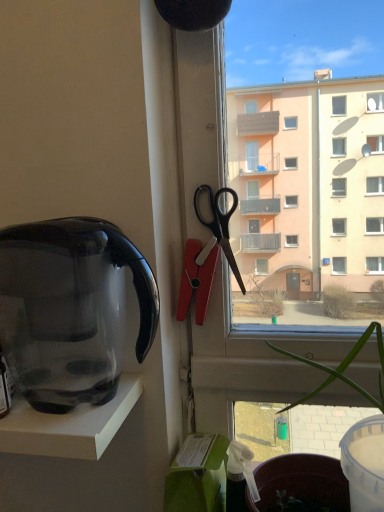
What do you see at coordinates (220, 225) in the screenshot?
I see `black plastic scissors at upper right` at bounding box center [220, 225].

You are a GUI agent. You are given a task and a screenshot of the screen. Output one action in this format:
    pyautogui.click(x=<x>, y=<y>)
    Task: Click on the black plastic scissors at upper right
    The image size is (384, 512).
    Given the screenshot: What is the action you would take?
    pyautogui.click(x=220, y=225)

In order to face green leafy plant at center, should I rotate leftwards or rightwards?

Turn right approximately 19.786 degrees to face it.

Locate an element on the screen. The image size is (384, 512). transparent plastic kettle at left is located at coordinates (71, 309).

Is transparent plastic kettle at left located outside green leafy plant at center?

Yes.

Which is closer to the camera, (81, 243) or (380, 393)?

Point (81, 243) is positioned closer to the camera compared to point (380, 393).

Is transparent plastic kettle at left bigger or smaller than green leafy plant at center?

In the image, transparent plastic kettle at left appears to be smaller than green leafy plant at center.

Would you say green leafy plant at center is to the left or to the right of black plastic scissors at upper right in the picture?

Based on their positions, green leafy plant at center is located to the right of black plastic scissors at upper right.

Between green leafy plant at center and black plastic scissors at upper right, which one has smaller size?

Smaller between the two is black plastic scissors at upper right.

Which object is closer to the camera, black plastic scissors at upper right or green leafy plant at center?

green leafy plant at center is more forward.

From the picture: From a real-world perspective, relative to green leafy plant at center, is black plastic scissors at upper right vertically above or below?

black plastic scissors at upper right is above green leafy plant at center.

Is black plastic scissors at upper right spatially inside green leafy plant at center, or outside of it?

black plastic scissors at upper right lies outside green leafy plant at center.

Is transparent plastic kettle at left with black plastic scissors at upper right?

No, transparent plastic kettle at left is not touching black plastic scissors at upper right.

How many degrees apart are the facing directions of transparent plastic kettle at left and black plastic scissors at upper right?

transparent plastic kettle at left and black plastic scissors at upper right are facing 99.7 degrees away from each other.

In terms of width, does transparent plastic kettle at left look wider or thinner when compared to black plastic scissors at upper right?

Considering their sizes, transparent plastic kettle at left looks broader than black plastic scissors at upper right.

Considering the points (24, 291) and (210, 224), which point is in front, point (24, 291) or point (210, 224)?

Positioned in front is point (24, 291).

Which of these two, black plastic scissors at upper right or transparent plastic kettle at left, stands shorter?

With less height is black plastic scissors at upper right.

Where is `scissors above the transparent plastic kettle at left (from a real-world perspective)`? The height and width of the screenshot is (512, 384). scissors above the transparent plastic kettle at left (from a real-world perspective) is located at coordinates (220, 225).

Considering the points (216, 239) and (116, 239), which point is in front, point (216, 239) or point (116, 239)?

Point (116, 239)

In terms of width, does black plastic scissors at upper right look wider or thinner when compared to transparent plastic kettle at left?

black plastic scissors at upper right is thinner than transparent plastic kettle at left.

From the image's perspective, does green leafy plant at center appear higher than transparent plastic kettle at left?

No, from the image's perspective, green leafy plant at center is not above transparent plastic kettle at left.

From a real-world perspective, who is located lower, green leafy plant at center or transparent plastic kettle at left?

green leafy plant at center.

In terms of size, does green leafy plant at center appear bigger or smaller than transparent plastic kettle at left?

In the image, green leafy plant at center appears to be larger than transparent plastic kettle at left.

Is green leafy plant at center shorter than transparent plastic kettle at left?

Incorrect, the height of green leafy plant at center does not fall short of that of transparent plastic kettle at left.

You are a GUI agent. You are given a task and a screenshot of the screen. Output one action in this format:
    pyautogui.click(x=<x>, y=<y>)
    Task: Click on the kettle above the green leafy plant at center (from the image's perspective)
    
    Given the screenshot: What is the action you would take?
    pyautogui.click(x=71, y=309)

Where is `houseplant that is on the right side of black plastic scissors at upper right`? houseplant that is on the right side of black plastic scissors at upper right is located at coordinates (343, 368).

Considering their positions, is black plastic scissors at upper right positioned further to green leafy plant at center than transparent plastic kettle at left?

The object further to green leafy plant at center is transparent plastic kettle at left.

Estimate the real-world distances between objects in this image. Which object is closer to green leafy plant at center, transparent plastic kettle at left or black plastic scissors at upper right?

black plastic scissors at upper right.

Looking at the image, which one is located further to black plastic scissors at upper right, green leafy plant at center or transparent plastic kettle at left?

transparent plastic kettle at left lies further to black plastic scissors at upper right than the other object.

Estimate the real-world distances between objects in this image. Which object is closer to transparent plastic kettle at left, green leafy plant at center or black plastic scissors at upper right?

black plastic scissors at upper right is closer to transparent plastic kettle at left.

Considering their positions, is black plastic scissors at upper right positioned further to transparent plastic kettle at left than green leafy plant at center?

Among the two, green leafy plant at center is located further to transparent plastic kettle at left.

Considering their positions, is transparent plastic kettle at left positioned closer to black plastic scissors at upper right than green leafy plant at center?

A: green leafy plant at center lies closer to black plastic scissors at upper right than the other object.

Locate an element on the screen. The height and width of the screenshot is (512, 384). kettle between green leafy plant at center and black plastic scissors at upper right from front to back is located at coordinates (71, 309).